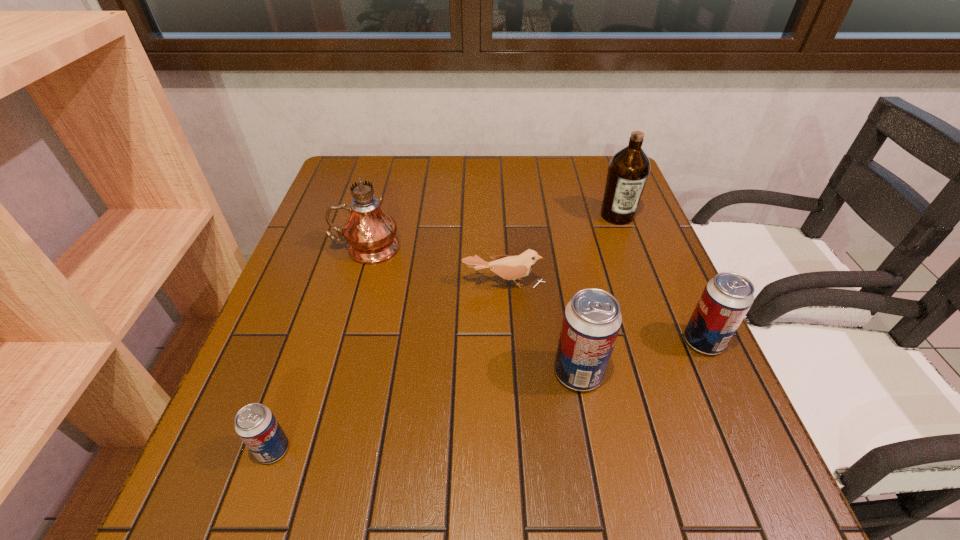
Identify the location of the shortest beer can. This screenshot has width=960, height=540. (255, 424).

Find the location of a particular element. Image resolution: width=960 pixels, height=540 pixels. the leftmost beer can is located at coordinates (255, 424).

You are a GUI agent. You are given a task and a screenshot of the screen. Output one action in this format:
    pyautogui.click(x=<x>, y=<y>)
    Task: Click on the second beer can from right to left
    The image size is (960, 540).
    Given the screenshot: What is the action you would take?
    (592, 319)

Identify the location of the rightmost beer can. Image resolution: width=960 pixels, height=540 pixels. (726, 299).

You are a GUI agent. You are given a task and a screenshot of the screen. Output one action in this format:
    pyautogui.click(x=<x>, y=<y>)
    Task: Click on the second shortest beer can
    
    Given the screenshot: What is the action you would take?
    pyautogui.click(x=726, y=299)

Locate an element on the screen. the second farthest object is located at coordinates (370, 232).

You are a GUI agent. You are given a task and a screenshot of the screen. Output one action in this format:
    pyautogui.click(x=<x>, y=<y>)
    Task: Click on the tallest object
    The height and width of the screenshot is (540, 960).
    Given the screenshot: What is the action you would take?
    pyautogui.click(x=370, y=232)

The height and width of the screenshot is (540, 960). What are the coordinates of `the farthest object` in the screenshot? It's located at (628, 170).

The width and height of the screenshot is (960, 540). In order to click on olive oil in this screenshot , I will do `click(628, 170)`.

What are the coordinates of `bird` in the screenshot? It's located at (508, 267).